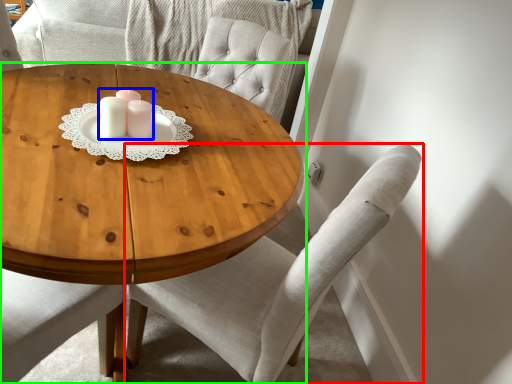
Question: Which object is positioned closest to chair (highlighted by a red box)? Select from candle holder (highlighted by a blue box) and coffee table (highlighted by a green box).

Choices:
 (A) candle holder
 (B) coffee table

Answer: (B)